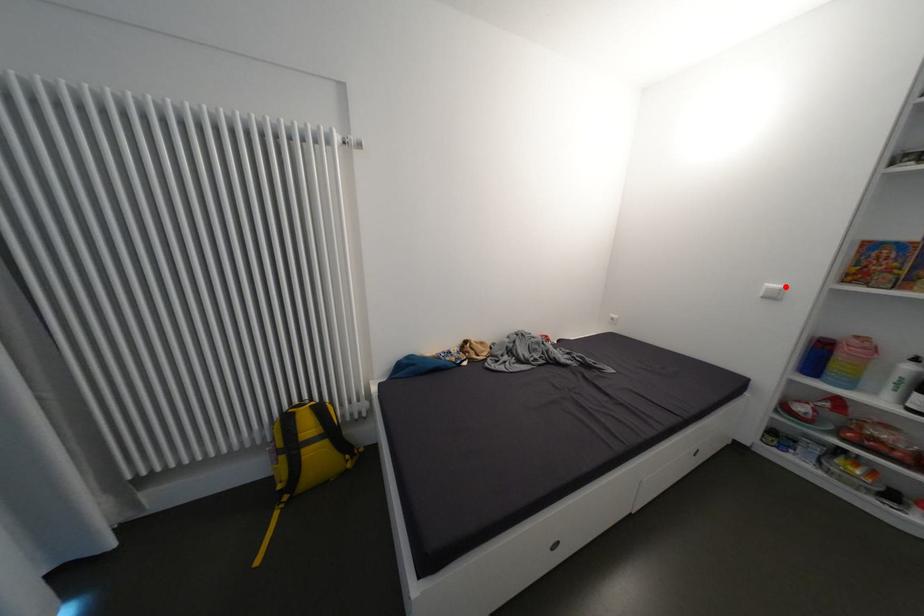
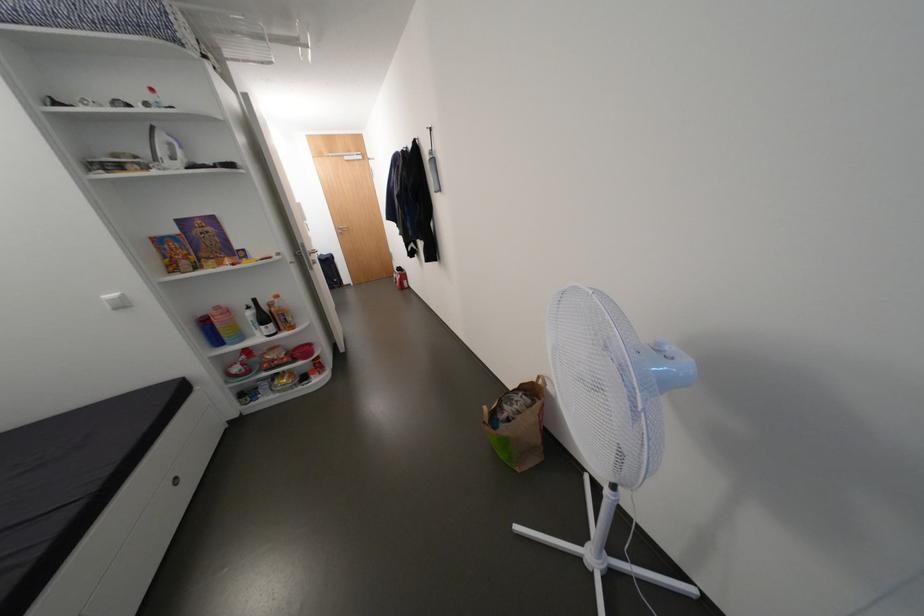
In the second image, find the point that corresponds to the highlighted location in the first image.

(120, 296)